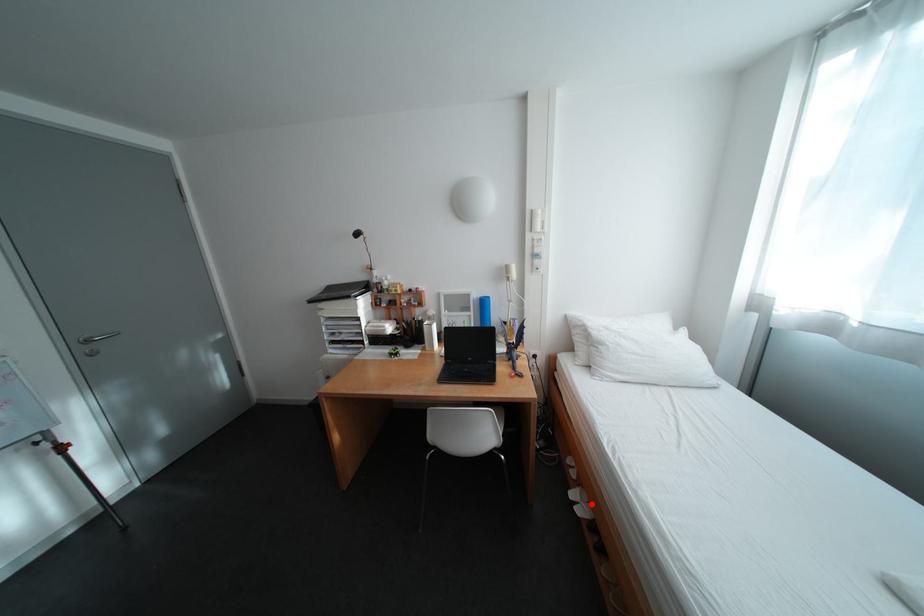
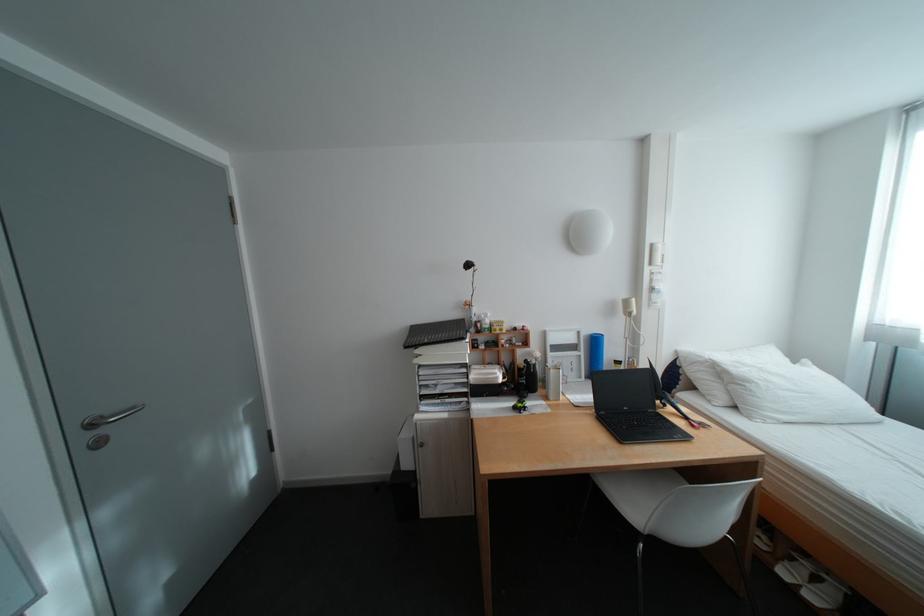
In the second image, find the point that corresponds to the highlighted location in the first image.

(813, 586)